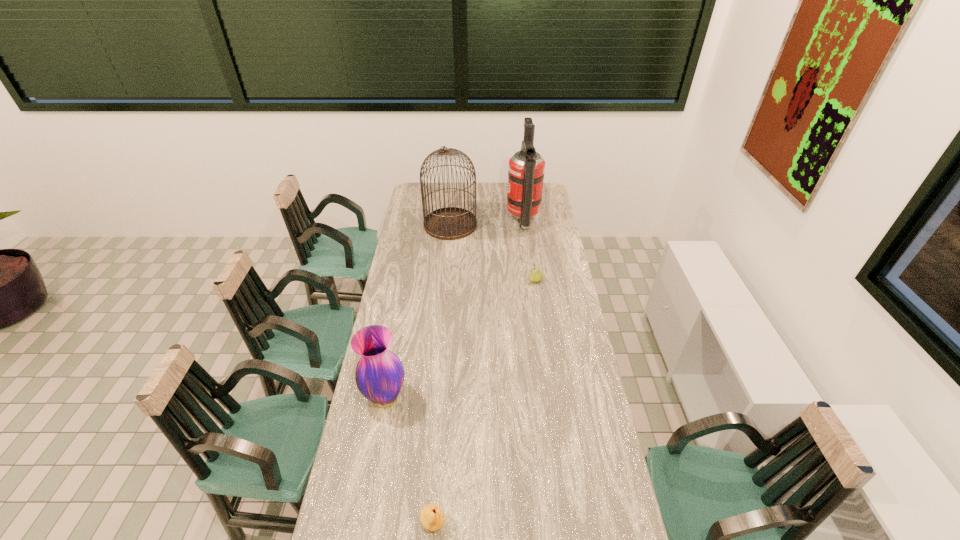
Identify the location of vacant area at the left edge. (363, 429).

Where is `vacant area at the right edge`? Image resolution: width=960 pixels, height=540 pixels. vacant area at the right edge is located at coordinates (551, 380).

Locate an element on the screen. The width and height of the screenshot is (960, 540). empty space between the nearest object and the third shortest object is located at coordinates (409, 461).

Image resolution: width=960 pixels, height=540 pixels. I want to click on free space between the farther pear and the third shortest object, so click(460, 339).

Locate an element on the screen. free space between the shortest object and the right pear is located at coordinates (485, 402).

I want to click on vacant space that is in between the second tallest object and the second nearest object, so click(x=418, y=311).

Where is `free space between the farther pear and the fourth farthest object`? Image resolution: width=960 pixels, height=540 pixels. free space between the farther pear and the fourth farthest object is located at coordinates (460, 339).

Locate an element on the screen. This screenshot has height=540, width=960. vacant space that's between the birdcage and the shorter pear is located at coordinates (442, 374).

The width and height of the screenshot is (960, 540). Identify the location of free area in between the birdcage and the shorter pear. (442, 374).

At what (x,y) coordinates should I click in order to perform the action: click on free space between the second tallest object and the third nearest object. Please return your answer as a coordinate pair (x, y). Image resolution: width=960 pixels, height=540 pixels. Looking at the image, I should click on (492, 253).